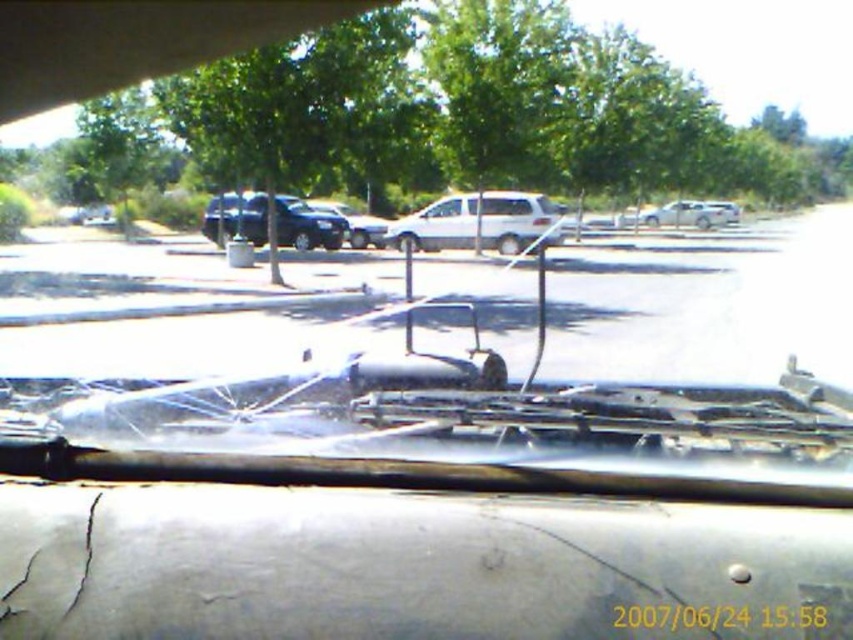
Does satin black suv at center appear under shiny black car at center?

Yes.

Who is shorter, satin black suv at center or shiny black car at center?

satin black suv at center

This screenshot has height=640, width=853. Identify the location of satin black suv at center. (306, 225).

Identify the location of satin black suv at center. (306, 225).

In the scene shown: Is white matte car at center positioned in front of satin black suv at center?

Yes, it is.

Can you confirm if white matte car at center is wider than satin black suv at center?

Yes.

Locate an element on the screen. white matte car at center is located at coordinates (706, 304).

Locate an element on the screen. This screenshot has height=640, width=853. white matte car at center is located at coordinates (706, 304).

Does white matte suv at center have a greater width compared to shiny black car at center?

No.

Where is `white matte suv at center`? white matte suv at center is located at coordinates (686, 214).

I want to click on white matte suv at center, so click(x=686, y=214).

Locate an element on the screen. white matte suv at center is located at coordinates (686, 214).